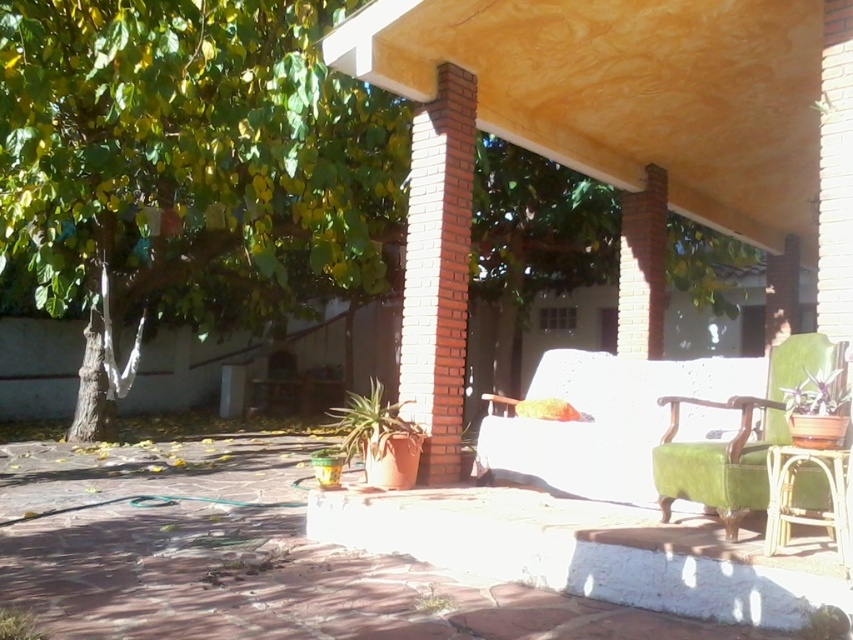
Is velvet green armchair at right to the left of green wicker chair at right from the viewer's perspective?

Correct, you'll find velvet green armchair at right to the left of green wicker chair at right.

Is velvet green armchair at right above green wicker chair at right?

Indeed, velvet green armchair at right is positioned over green wicker chair at right.

Which is in front, point (773, 440) or point (786, 484)?

Positioned in front is point (786, 484).

Image resolution: width=853 pixels, height=640 pixels. What are the coordinates of `velvet green armchair at right` in the screenshot? It's located at (737, 438).

Who is positioned more to the left, green leafy tree at upper left or velvet green armchair at right?

From the viewer's perspective, green leafy tree at upper left appears more on the left side.

Between green leafy tree at upper left and velvet green armchair at right, which one has more height?

Standing taller between the two is velvet green armchair at right.

Is point (54, 124) farther from viewer compared to point (820, 490)?

Yes, it is behind point (820, 490).

The image size is (853, 640). I want to click on green leafy tree at upper left, so click(190, 157).

Between point (630, 396) and point (840, 372), which one is positioned behind?

The point (630, 396) is more distant.

This screenshot has height=640, width=853. I want to click on velvet green armchair at center, so click(x=605, y=420).